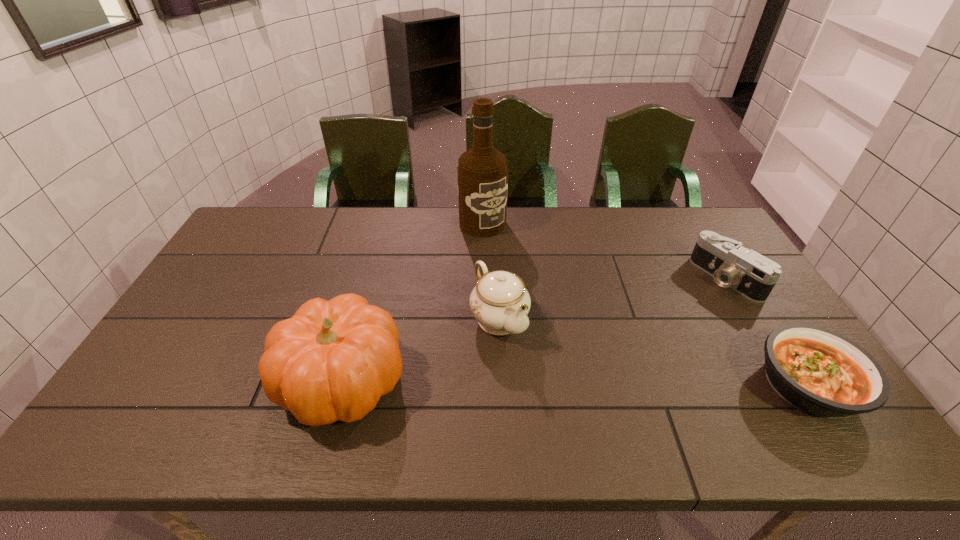
The height and width of the screenshot is (540, 960). I want to click on stew located at the right edge, so click(x=818, y=371).

In order to click on camera at the right edge in this screenshot , I will do click(x=752, y=275).

At what (x,y) coordinates should I click in order to perform the action: click on object situated at the near right corner. Please return your answer as a coordinate pair (x, y). The width and height of the screenshot is (960, 540). Looking at the image, I should click on (818, 371).

Where is `free space at the far edge of the desktop`? free space at the far edge of the desktop is located at coordinates tap(361, 218).

In order to click on free point at the near edge in this screenshot , I will do `click(406, 404)`.

The height and width of the screenshot is (540, 960). In the image, there is a desktop. What are the coordinates of `vacant space at the left edge` in the screenshot? It's located at (239, 247).

In the image, there is a desktop. In order to click on free space at the far left corner in this screenshot , I will do pos(276,237).

Image resolution: width=960 pixels, height=540 pixels. What are the coordinates of `free space at the far right corner of the desktop` in the screenshot? It's located at (688, 234).

The height and width of the screenshot is (540, 960). I want to click on empty space that is in between the pumpkin and the farthest object, so click(412, 302).

Identify the location of vacant point located between the chinaware and the shortest object. (654, 352).